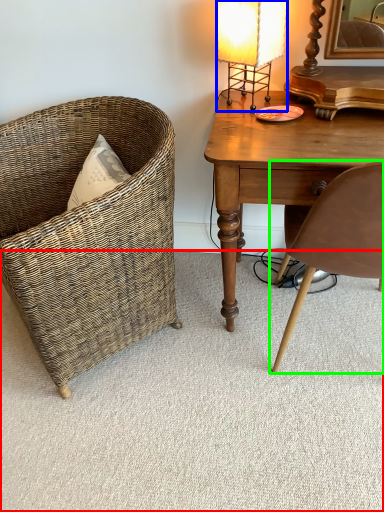
Question: Considering the real-world distances, which object is farthest from plain (highlighted by a red box)? lamp (highlighted by a blue box) or chair (highlighted by a green box)?

Choices:
 (A) lamp
 (B) chair

Answer: (A)